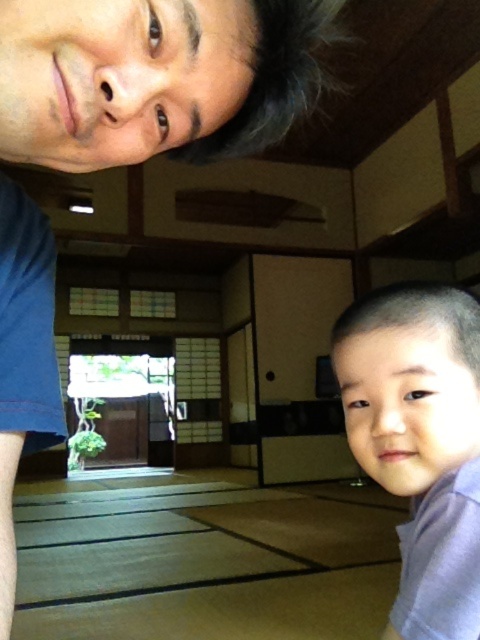
Between matte blue shirt at upper left and matte black hair at upper center, which one has less height?

matte black hair at upper center is shorter.

Who is more forward, (276,106) or (175,1)?

Positioned in front is point (175,1).

Locate an element on the screen. The height and width of the screenshot is (640, 480). matte blue shirt at upper left is located at coordinates (153, 77).

How far apart are matte blue shirt at upper left and light purple fabric at lower right?

The distance of matte blue shirt at upper left from light purple fabric at lower right is 31.24 centimeters.

Can you confirm if matte blue shirt at upper left is taller than light purple fabric at lower right?

Yes, matte blue shirt at upper left is taller than light purple fabric at lower right.

Which is behind, point (109, 156) or point (472, 520)?

The point (472, 520) is more distant.

The image size is (480, 640). In order to click on matte blue shirt at upper left in this screenshot , I will do `click(153, 77)`.

Measure the distance between matte black hair at upper center and light purple fabric at lower right.

matte black hair at upper center is 34.34 centimeters away from light purple fabric at lower right.

Image resolution: width=480 pixels, height=640 pixels. What do you see at coordinates (152, 77) in the screenshot?
I see `matte black hair at upper center` at bounding box center [152, 77].

Find the location of a particular element. This screenshot has width=480, height=640. matte black hair at upper center is located at coordinates (152, 77).